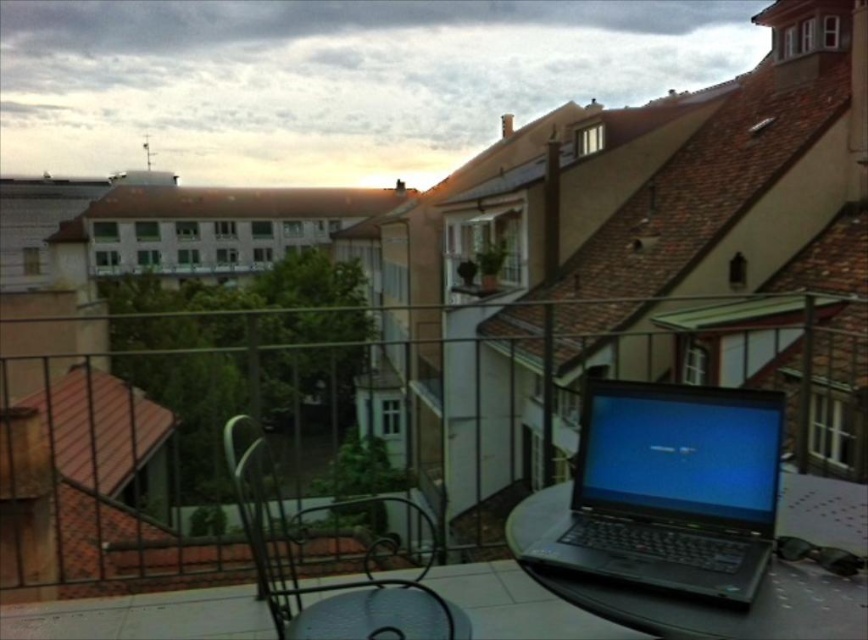
Is black glass table at lower right smaller than black wrought iron chair at center?

Yes, black glass table at lower right is smaller than black wrought iron chair at center.

Is point (656, 596) positioned before point (332, 506)?

Yes.

You are a GUI agent. You are given a task and a screenshot of the screen. Output one action in this format:
    pyautogui.click(x=<x>, y=<y>)
    Task: Click on the black glass table at lower right
    Image resolution: width=868 pixels, height=640 pixels.
    Given the screenshot: What is the action you would take?
    pyautogui.click(x=695, y=596)

Who is shorter, black matte laptop at center or transparent glass table at center?

With less height is transparent glass table at center.

Is point (589, 388) in front of point (299, 614)?

That is True.

I want to click on black matte laptop at center, so click(x=663, y=490).

Can you confirm if black glass table at lower right is smaller than transparent glass table at center?

No.

Who is taller, black glass table at lower right or transparent glass table at center?

transparent glass table at center

Does point (694, 612) come behind point (358, 600)?

No, (694, 612) is closer to viewer.

At what (x,y) coordinates should I click in order to perform the action: click on black glass table at lower right. Please return your answer as a coordinate pair (x, y). Image resolution: width=868 pixels, height=640 pixels. Looking at the image, I should click on (695, 596).